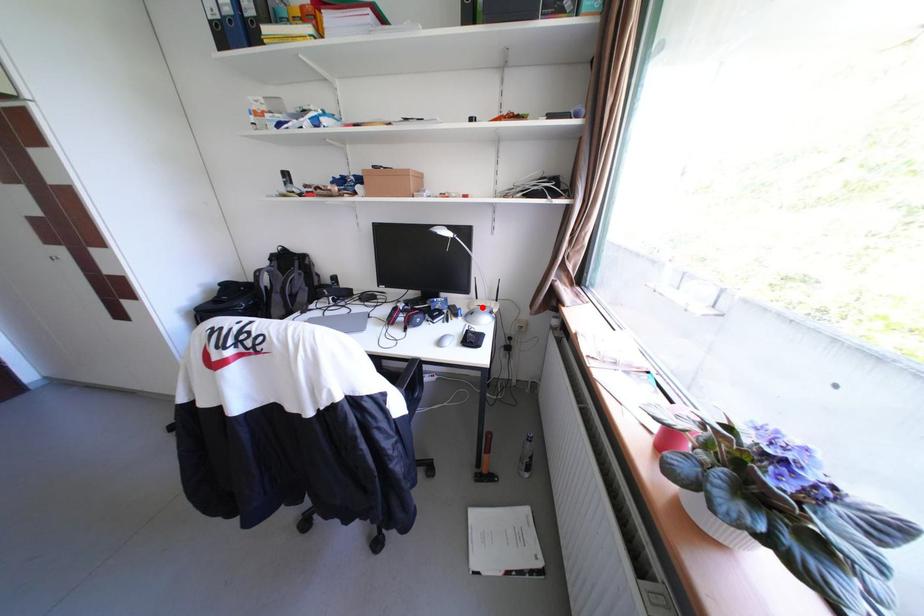
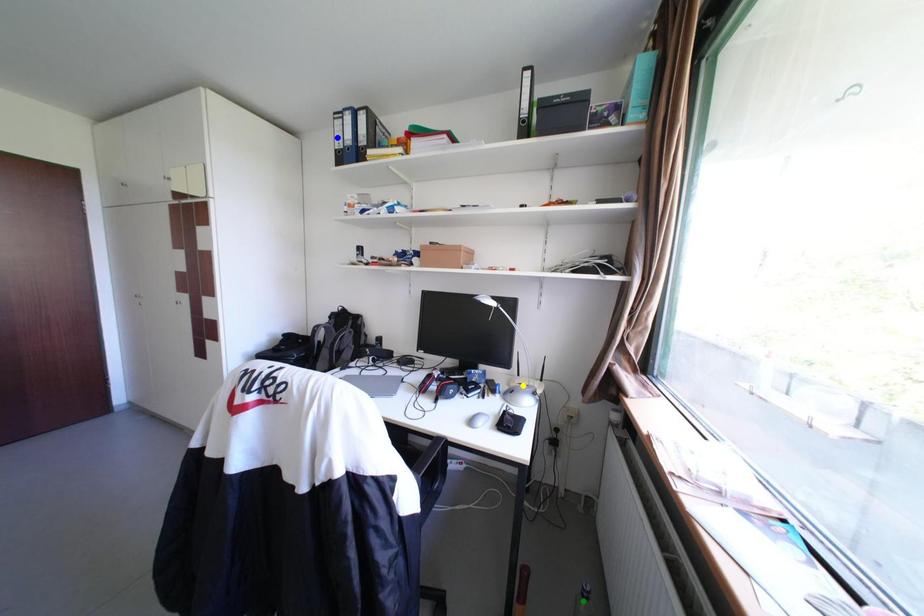
Question: I am providing you with two images of the same scene from different viewpoints. A red point is marked on the first image. You are given multiple points on the second image. In image 2, which mark is for the same physical point as the one in image 1?

Choices:
 (A) green point
 (B) yellow point
 (C) blue point

Answer: (B)